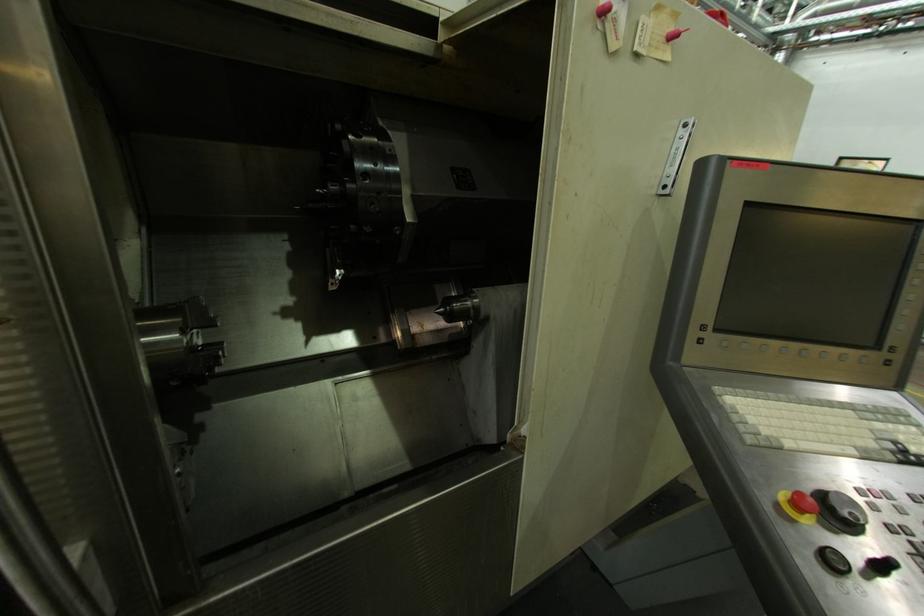
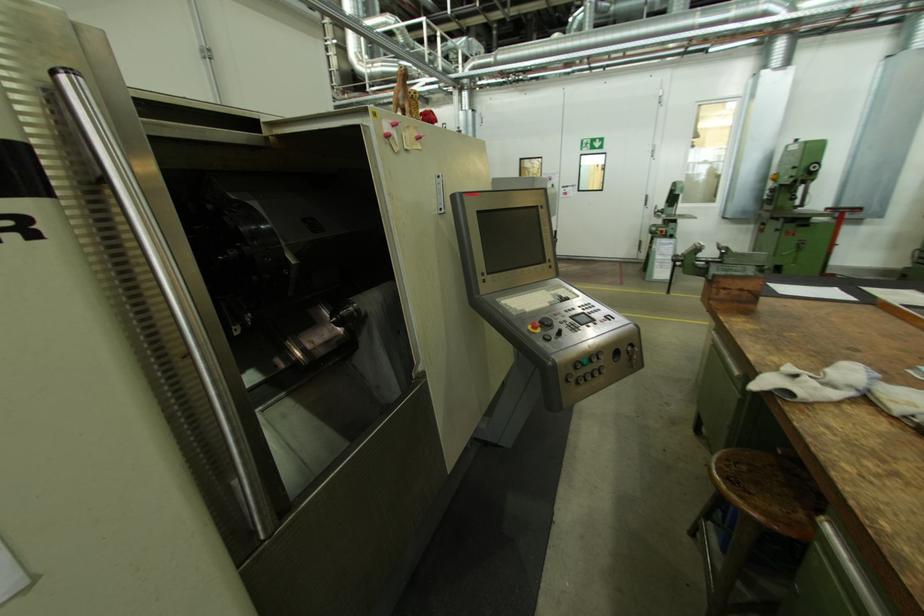
Where in the second image is the point corresponding to the point at 787,498 from the first image?

(535, 329)